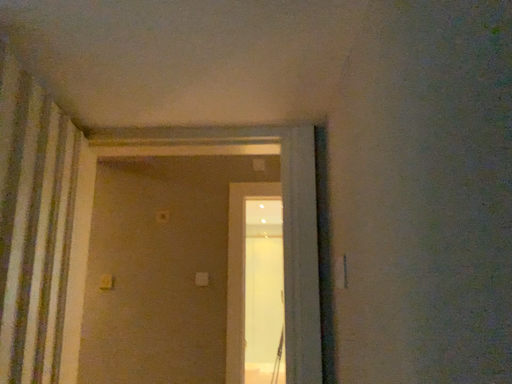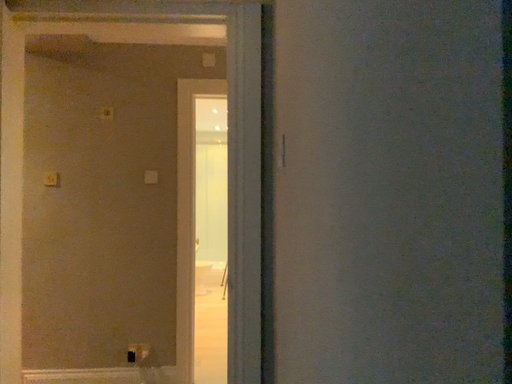
Question: Which way did the camera rotate in the video?

Choices:
 (A) rotated upward
 (B) rotated downward

Answer: (B)